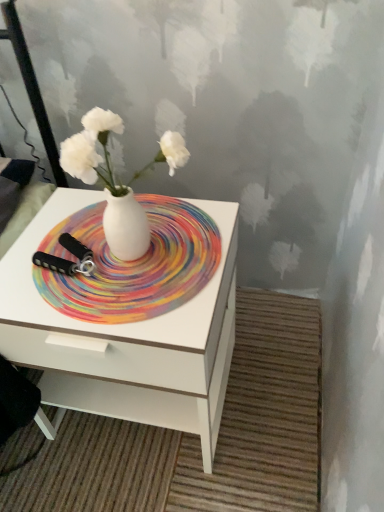
Where is `blank space situated above white glossy nightstand at center (from a real-world perspective)`? This screenshot has width=384, height=512. blank space situated above white glossy nightstand at center (from a real-world perspective) is located at coordinates (111, 255).